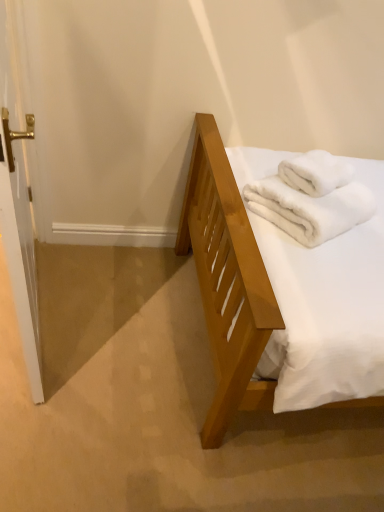
Question: Is the position of white glossy door handle at left less distant than that of white fluffy bath towel at upper right, arranged as the first bath towel when ordered from the bottom?

Choices:
 (A) yes
 (B) no

Answer: (A)

Question: Is white glossy door handle at left to the left of white fluffy bath towel at upper right, arranged as the first bath towel when ordered from the bottom, from the viewer's perspective?

Choices:
 (A) yes
 (B) no

Answer: (A)

Question: Considering the relative sizes of white glossy door handle at left and white fluffy bath towel at upper right, the second bath towel viewed from the top, in the image provided, is white glossy door handle at left bigger than white fluffy bath towel at upper right, the second bath towel viewed from the top,?

Choices:
 (A) no
 (B) yes

Answer: (B)

Question: From a real-world perspective, is white glossy door handle at left physically above white fluffy bath towel at upper right, arranged as the first bath towel when ordered from the bottom?

Choices:
 (A) no
 (B) yes

Answer: (A)

Question: Is white fluffy bath towel at upper right, arranged as the first bath towel when ordered from the bottom, inside white glossy door handle at left?

Choices:
 (A) yes
 (B) no

Answer: (B)

Question: From a real-world perspective, relative to white fluffy bath towel at upper right, positioned as the 1th bath towel in top-to-bottom order, is white fluffy bath towel at upper right, the second bath towel viewed from the top, vertically above or below?

Choices:
 (A) below
 (B) above

Answer: (A)

Question: Is white fluffy bath towel at upper right, arranged as the first bath towel when ordered from the bottom, to the left or to the right of white fluffy bath towel at upper right, placed as the second bath towel when sorted from bottom to top, in the image?

Choices:
 (A) right
 (B) left

Answer: (B)

Question: Which is correct: white fluffy bath towel at upper right, arranged as the first bath towel when ordered from the bottom, is inside white fluffy bath towel at upper right, placed as the second bath towel when sorted from bottom to top, or outside of it?

Choices:
 (A) outside
 (B) inside

Answer: (A)

Question: Based on their sizes in the image, would you say white fluffy bath towel at upper right, arranged as the first bath towel when ordered from the bottom, is bigger or smaller than white fluffy bath towel at upper right, placed as the second bath towel when sorted from bottom to top?

Choices:
 (A) small
 (B) big

Answer: (B)

Question: Is point (3, 234) closer or farther from the camera than point (304, 209)?

Choices:
 (A) farther
 (B) closer

Answer: (B)

Question: From the image's perspective, relative to white fluffy bath towel at upper right, the second bath towel viewed from the top, is white glossy door handle at left above or below?

Choices:
 (A) above
 (B) below

Answer: (B)

Question: Based on their sizes in the image, would you say white glossy door handle at left is bigger or smaller than white fluffy bath towel at upper right, arranged as the first bath towel when ordered from the bottom?

Choices:
 (A) big
 (B) small

Answer: (A)

Question: Considering their positions, is white glossy door handle at left located in front of or behind white fluffy bath towel at upper right, the second bath towel viewed from the top?

Choices:
 (A) behind
 (B) front

Answer: (B)

Question: Based on their sizes in the image, would you say white fluffy bath towel at upper right, the second bath towel viewed from the top, is bigger or smaller than white glossy door handle at left?

Choices:
 (A) big
 (B) small

Answer: (B)

Question: From the image's perspective, relative to white glossy door handle at left, is white fluffy bath towel at upper right, the second bath towel viewed from the top, above or below?

Choices:
 (A) below
 (B) above

Answer: (B)